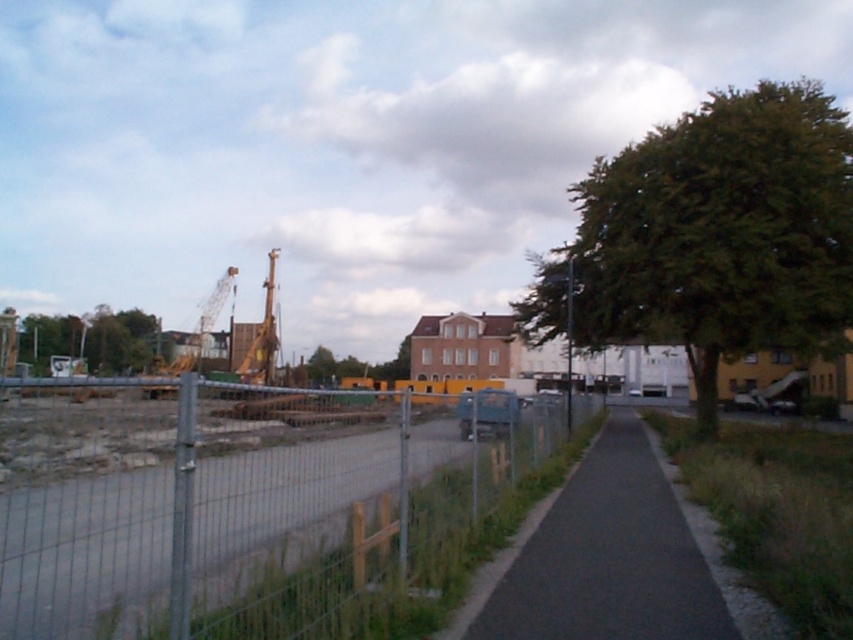
You are a delivery person needing to cross the black asphalt pavement at center and the green leafy tree at center. Which one do you have to go around instead of going straight through?

The green leafy tree at center has a larger size than the black asphalt pavement at center, so you would need to go around the green leafy tree at center instead of going straight through.

You are standing at the point labeled as point (248, 506) in the urban scene. Based on the coordinates, which object are you closest to?

The point labeled as point (248, 506) corresponds to the metal wire fence at center, so you are closest to the metal wire fence at center.

You are standing at the construction site fence on the left. You want to walk to the point marked at coordinates (606,556). Is the path to this point paved?

The point at coordinates (606,556) is on black asphalt pavement at center, so yes, the path to this point is paved.